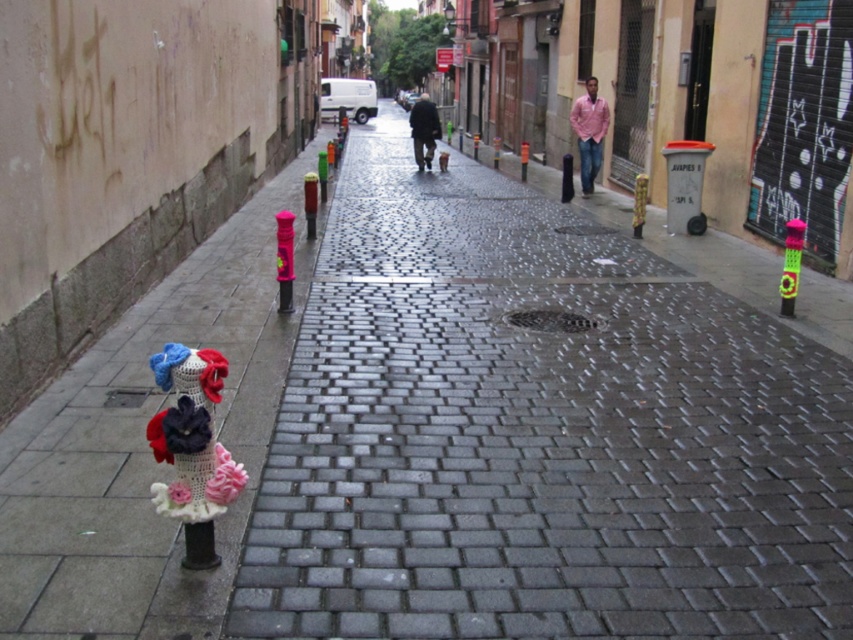
Question: Can you confirm if neon green plastic pole at center is wider than pink fabric at center?

Choices:
 (A) yes
 (B) no

Answer: (B)

Question: Which point is farther to the camera?

Choices:
 (A) pink fabric at center
 (B) yarn knitted flowers at left

Answer: (A)

Question: Does crochet yarn hydrant at lower left appear under neon green plastic pole at center?

Choices:
 (A) no
 (B) yes

Answer: (B)

Question: Which is nearer to the yarn knitted flowers at left?

Choices:
 (A) multicolored knitted hydrant at right
 (B) dark gray jacket at center

Answer: (A)

Question: Among these objects, which one is nearest to the camera?

Choices:
 (A) multicolored knitted hydrant at right
 (B) yarn knitted flowers at left

Answer: (B)

Question: Observing the image, what is the correct spatial positioning of multicolored knitted hydrant at right in reference to pink fabric at center?

Choices:
 (A) right
 (B) left

Answer: (A)